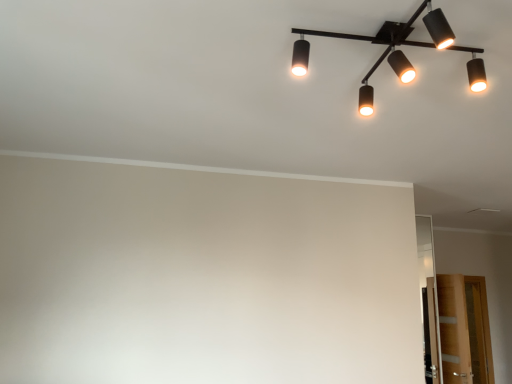
Question: Considering the relative positions of matte black light fixture at upper center and transparent glass door at lower right in the image provided, is matte black light fixture at upper center behind transparent glass door at lower right?

Choices:
 (A) yes
 (B) no

Answer: (B)

Question: Does matte black light fixture at upper center have a greater height compared to transparent glass door at lower right?

Choices:
 (A) no
 (B) yes

Answer: (A)

Question: Does matte black light fixture at upper center appear on the left side of transparent glass door at lower right?

Choices:
 (A) yes
 (B) no

Answer: (A)

Question: Is matte black light fixture at upper center thinner than transparent glass door at lower right?

Choices:
 (A) yes
 (B) no

Answer: (B)

Question: From the image's perspective, would you say matte black light fixture at upper center is shown under transparent glass door at lower right?

Choices:
 (A) no
 (B) yes

Answer: (A)

Question: From a real-world perspective, is matte black light fixture at upper center beneath transparent glass door at lower right?

Choices:
 (A) no
 (B) yes

Answer: (A)

Question: Is transparent glass door at lower right shorter than matte black light fixture at upper center?

Choices:
 (A) yes
 (B) no

Answer: (B)

Question: Is transparent glass door at lower right positioned far away from matte black light fixture at upper center?

Choices:
 (A) no
 (B) yes

Answer: (B)

Question: Is transparent glass door at lower right wider than matte black light fixture at upper center?

Choices:
 (A) no
 (B) yes

Answer: (A)

Question: Is transparent glass door at lower right looking in the opposite direction of matte black light fixture at upper center?

Choices:
 (A) no
 (B) yes

Answer: (A)

Question: From the image's perspective, is transparent glass door at lower right beneath matte black light fixture at upper center?

Choices:
 (A) yes
 (B) no

Answer: (A)

Question: Is matte black light fixture at upper center a part of transparent glass door at lower right?

Choices:
 (A) no
 (B) yes

Answer: (A)

Question: From their relative heights in the image, would you say matte black light fixture at upper center is taller or shorter than transparent glass door at lower right?

Choices:
 (A) short
 (B) tall

Answer: (A)